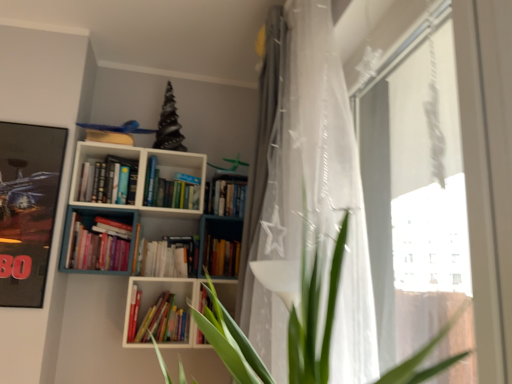
Question: Is hardcover book at center, arranged as the 4th book when viewed from the left, bigger than white sheer curtain at center, the second curtain viewed from the back?

Choices:
 (A) yes
 (B) no

Answer: (B)

Question: Can you confirm if hardcover book at center, arranged as the third book when viewed from the top, is shorter than white sheer curtain at center, placed as the 1th curtain when sorted from front to back?

Choices:
 (A) no
 (B) yes

Answer: (B)

Question: Is hardcover book at center, arranged as the third book when viewed from the top, not near white sheer curtain at center, the second curtain viewed from the back?

Choices:
 (A) no
 (B) yes

Answer: (B)

Question: From a real-world perspective, is hardcover book at center, which is the first book from right to left, over white sheer curtain at center, placed as the 1th curtain when sorted from front to back?

Choices:
 (A) no
 (B) yes

Answer: (A)

Question: Considering the relative sizes of hardcover book at center, the 2th book positioned from the bottom, and white sheer curtain at center, placed as the 1th curtain when sorted from front to back, in the image provided, is hardcover book at center, the 2th book positioned from the bottom, smaller than white sheer curtain at center, placed as the 1th curtain when sorted from front to back,?

Choices:
 (A) no
 (B) yes

Answer: (B)

Question: Is hardcover book at center, the 2th book positioned from the bottom, taller than white sheer curtain at center, the second curtain viewed from the back?

Choices:
 (A) yes
 (B) no

Answer: (B)

Question: Considering the relative sizes of hardcover books at center-left, the first book in the top-to-bottom sequence, and white matte bookcase at upper center in the image provided, is hardcover books at center-left, the first book in the top-to-bottom sequence, smaller than white matte bookcase at upper center?

Choices:
 (A) no
 (B) yes

Answer: (B)

Question: Is hardcover books at center-left, the 4th book viewed from the right, behind white matte bookcase at upper center?

Choices:
 (A) yes
 (B) no

Answer: (A)

Question: Is hardcover books at center-left, the first book in the top-to-bottom sequence, shorter than white matte bookcase at upper center?

Choices:
 (A) yes
 (B) no

Answer: (A)

Question: Does hardcover books at center-left, the 4th book viewed from the right, touch white matte bookcase at upper center?

Choices:
 (A) no
 (B) yes

Answer: (A)

Question: Can you confirm if hardcover books at center-left, which appears as the 1th book when viewed from the left, is taller than white matte bookcase at upper center?

Choices:
 (A) no
 (B) yes

Answer: (A)

Question: Can you confirm if hardcover books at center-left, the 4th book viewed from the right, is positioned to the left of white matte bookcase at upper center?

Choices:
 (A) yes
 (B) no

Answer: (A)

Question: Is white sheer curtain at center, placed as the 1th curtain when sorted from front to back, taller than white matte bookcase at upper center?

Choices:
 (A) yes
 (B) no

Answer: (A)